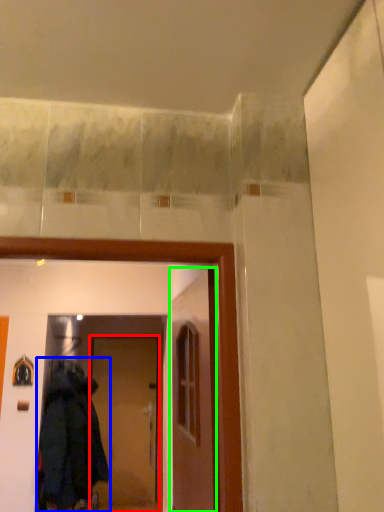
Question: Considering the real-world distances, which object is farthest from door (highlighted by a red box)? coat (highlighted by a blue box) or door (highlighted by a green box)?

Choices:
 (A) coat
 (B) door

Answer: (B)